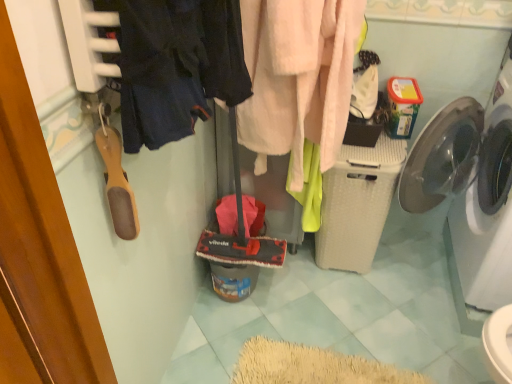
Question: In which direction should I rotate to look at fuzzy pink towel at center, placed as the second clothing when sorted from left to right?

Choices:
 (A) left
 (B) right

Answer: (B)

Question: Can you confirm if white plastic washing machine at right, positioned as the 2th washing machine in left-to-right order, is thinner than dark blue fabric at upper left, the 2th clothing positioned from the back?

Choices:
 (A) yes
 (B) no

Answer: (B)

Question: Is white plastic washing machine at right, positioned as the 2th washing machine in left-to-right order, to the left of dark blue fabric at upper left, which is counted as the 1th clothing, starting from the left, from the viewer's perspective?

Choices:
 (A) yes
 (B) no

Answer: (B)

Question: Does white plastic washing machine at right, the first washing machine when ordered from right to left, have a greater width compared to dark blue fabric at upper left, positioned as the 2th clothing in right-to-left order?

Choices:
 (A) no
 (B) yes

Answer: (B)

Question: Can you confirm if white plastic washing machine at right, positioned as the 2th washing machine in left-to-right order, is smaller than dark blue fabric at upper left, the first clothing viewed from the front?

Choices:
 (A) yes
 (B) no

Answer: (B)

Question: From a real-world perspective, is white plastic washing machine at right, positioned as the 2th washing machine in left-to-right order, under dark blue fabric at upper left, which is counted as the 1th clothing, starting from the left?

Choices:
 (A) no
 (B) yes

Answer: (B)

Question: Is white plastic washing machine at right, positioned as the 2th washing machine in left-to-right order, completely or partially outside of dark blue fabric at upper left, the first clothing viewed from the front?

Choices:
 (A) no
 (B) yes

Answer: (B)

Question: Is dark blue fabric at upper left, the 2th clothing positioned from the back, to the right of white plastic washing machine at right, the first washing machine when ordered from right to left, from the viewer's perspective?

Choices:
 (A) yes
 (B) no

Answer: (B)

Question: Is dark blue fabric at upper left, which is counted as the 1th clothing, starting from the left, not within white plastic washing machine at right, positioned as the 2th washing machine in left-to-right order?

Choices:
 (A) no
 (B) yes

Answer: (B)

Question: Is dark blue fabric at upper left, the first clothing viewed from the front, smaller than white plastic washing machine at right, positioned as the 2th washing machine in left-to-right order?

Choices:
 (A) yes
 (B) no

Answer: (A)

Question: Considering the relative sizes of dark blue fabric at upper left, which is counted as the 1th clothing, starting from the left, and white plastic washing machine at right, positioned as the 2th washing machine in left-to-right order, in the image provided, is dark blue fabric at upper left, which is counted as the 1th clothing, starting from the left, taller than white plastic washing machine at right, positioned as the 2th washing machine in left-to-right order,?

Choices:
 (A) no
 (B) yes

Answer: (A)

Question: Is dark blue fabric at upper left, the first clothing viewed from the front, positioned behind white plastic washing machine at right, the first washing machine when ordered from right to left?

Choices:
 (A) no
 (B) yes

Answer: (A)

Question: Does dark blue fabric at upper left, the first clothing viewed from the front, turn towards white plastic washing machine at right, the first washing machine when ordered from right to left?

Choices:
 (A) no
 (B) yes

Answer: (A)

Question: Does dark blue fabric at upper left, the 2th clothing positioned from the back, come in front of fuzzy pink towel at center, placed as the first clothing when sorted from right to left?

Choices:
 (A) yes
 (B) no

Answer: (A)